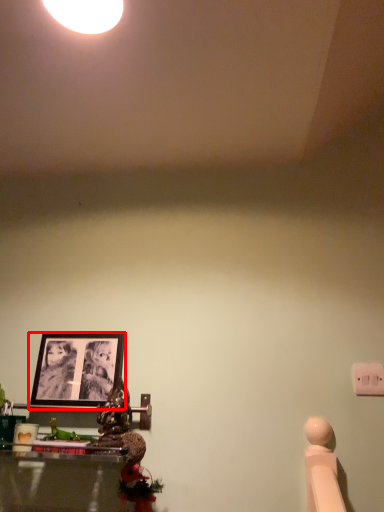
Question: Where is picture frame (annotated by the red box) located in relation to light switch in the image?

Choices:
 (A) right
 (B) left

Answer: (B)